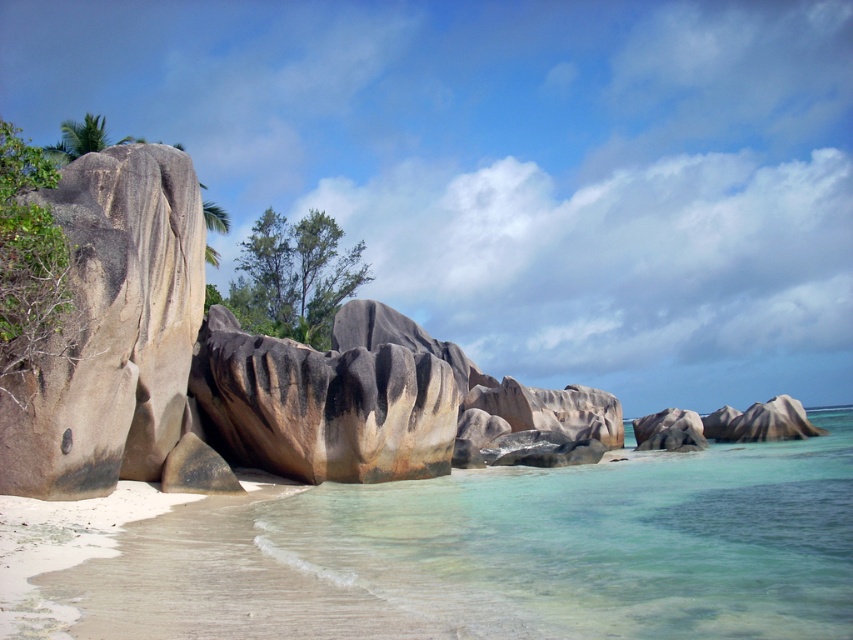
Question: Is clear glassy water at lower center closer to camera compared to rustic stone boulder at left?

Choices:
 (A) no
 (B) yes

Answer: (B)

Question: Which of the following is the closest to the observer?

Choices:
 (A) (354, 440)
 (B) (393, 566)

Answer: (B)

Question: Is clear glassy water at lower center above rustic stone boulder at left?

Choices:
 (A) yes
 (B) no

Answer: (B)

Question: Is clear glassy water at lower center to the left of rustic stone boulder at left from the viewer's perspective?

Choices:
 (A) no
 (B) yes

Answer: (A)